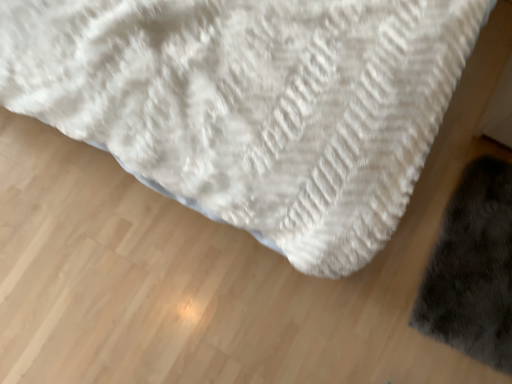
The image size is (512, 384). In order to click on vacant point to the left of dark gray fluffy mat at lower right in this screenshot , I will do `click(360, 292)`.